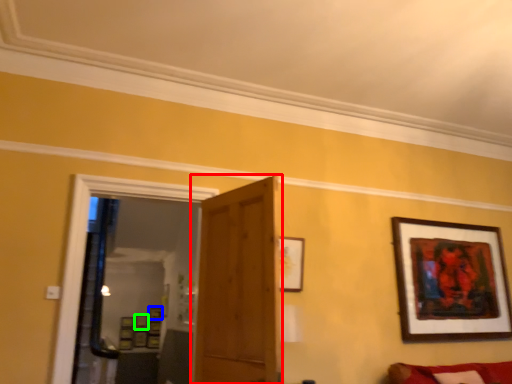
Question: Considering the real-world distances, which object is closest to door (highlighted by a red box)? picture frame (highlighted by a blue box) or picture frame (highlighted by a green box).

Choices:
 (A) picture frame
 (B) picture frame

Answer: (A)